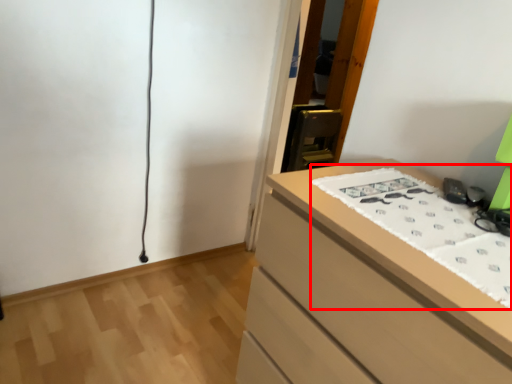
Question: In this image, where is sheet (annotated by the red box) located relative to chest of drawers?

Choices:
 (A) right
 (B) left

Answer: (A)